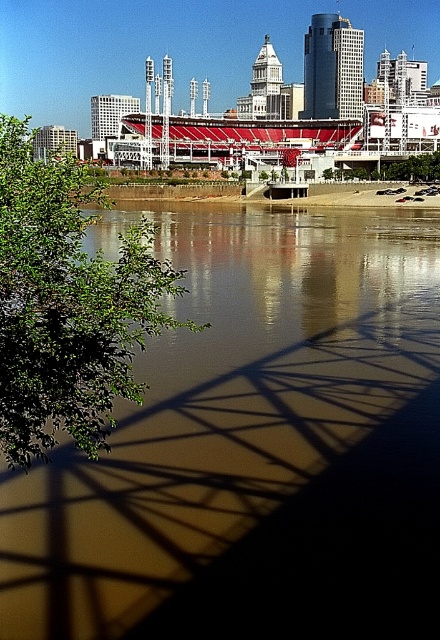
You are standing at the riverside and want to take a photo of the baseball stadium. The brown reflective water at center and the green leafy tree at left are in your view. Which object should you focus on first to ensure the baseball stadium is clearly visible in your photo?

You should focus on the green leafy tree at left first because the brown reflective water at center is in front of it, so focusing on the tree will help ensure the stadium behind the water is in clear focus.

You are standing at the baseball stadium in the image and want to locate the point at coordinates [253,445]. According to the scene description, where would this point be located?

The point at coordinates [253,445] is on the brown reflective water at center.

You are standing at the riverbank looking towards the baseball stadium. There are two points marked in the image at coordinates point (222, 432) and point (102, 324). Which point is closer to your current position?

Point (102, 324) is closer to your current position because it is nearer to the camera compared to point (222, 432), which is further away.